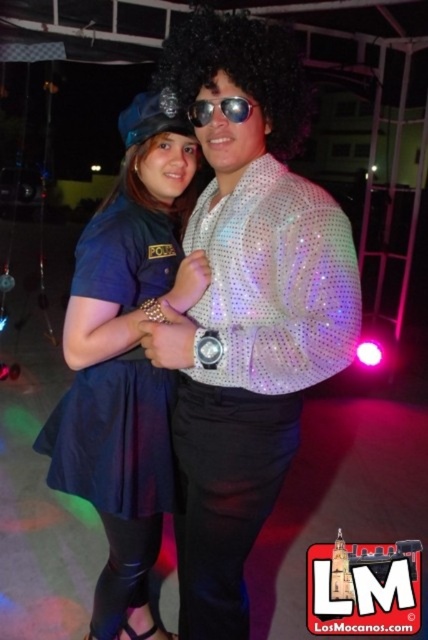
From the picture: You are trying to take a photo of the shiny sequined shirt at center and sunglasses at center. Which object should you focus on first if you want to capture both in one shot without moving the camera?

The shiny sequined shirt at center might be wider than sunglasses at center, so you should focus on the sunglasses at center first to ensure both fit in the frame.

You are a photographer at the event and want to capture a closeup of the blue fabric skirt at center without the sunglasses at center blocking the view. Is it possible to do so based on their positions?

The blue fabric skirt at center is further to the viewer than sunglasses at center, so the skirt is closer to the photographer and would block the sunglasses. Therefore, it might not be possible to capture a clear closeup of the skirt without the sunglasses being in the background.